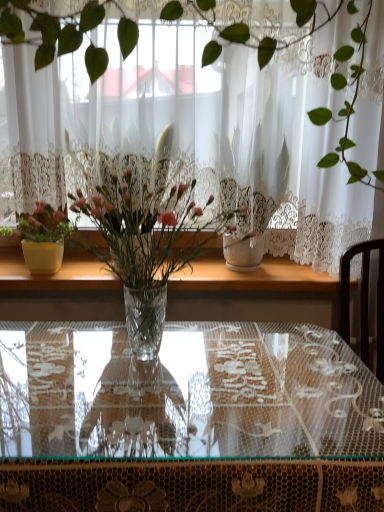
You are a GUI agent. You are given a task and a screenshot of the screen. Output one action in this format:
    pyautogui.click(x=<x>, y=<y>)
    Task: Click on the free space in front of clear glass vase at center, which is the 1th houseplant from right to left
    
    Given the screenshot: What is the action you would take?
    point(142,435)